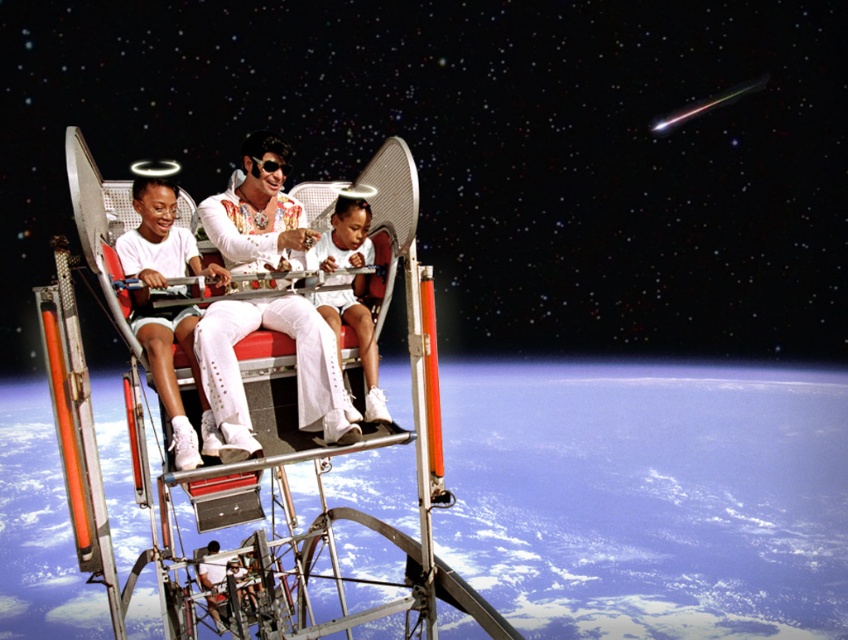
You are an astronaut floating in space and need to identify which clothing item is closer to you. Based on the scene, which is closer, the white satin suit at center or the white matte shorts at left?

The white satin suit at center is closer to you because the white matte shorts at left is behind it.